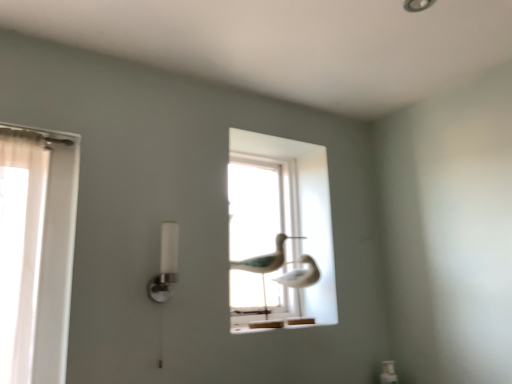
Question: Considering the positions of transparent glass birds at center and white frosted glass lamp at center left in the image, is transparent glass birds at center bigger or smaller than white frosted glass lamp at center left?

Choices:
 (A) big
 (B) small

Answer: (A)

Question: In terms of width, does transparent glass birds at center look wider or thinner when compared to white frosted glass lamp at center left?

Choices:
 (A) thin
 (B) wide

Answer: (B)

Question: Estimate the real-world distances between objects in this image. Which object is closer to the transparent glass birds at center?

Choices:
 (A) white matte bird at center
 (B) white frosted glass lamp at center left

Answer: (A)

Question: Considering the real-world distances, which object is closest to the white matte bird at center?

Choices:
 (A) transparent glass birds at center
 (B) white frosted glass lamp at center left

Answer: (A)